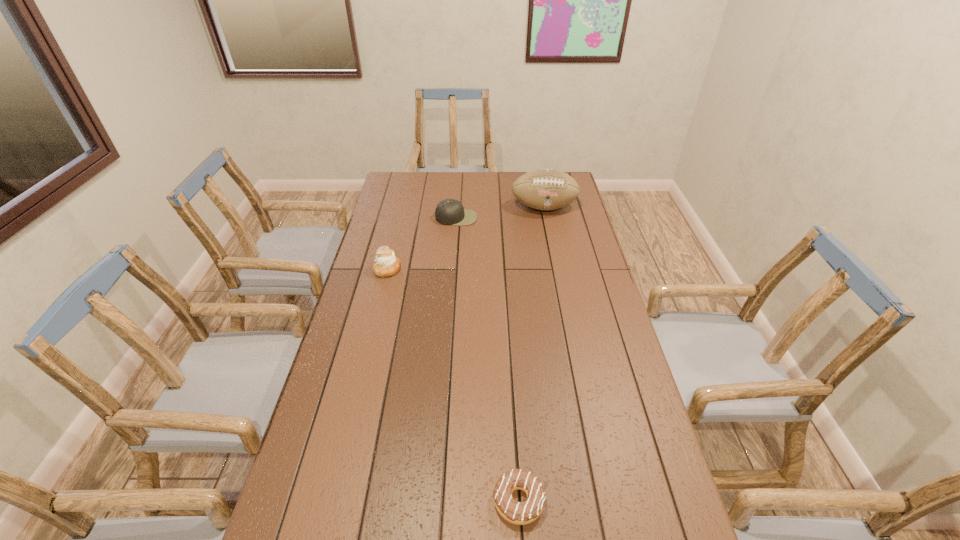
This screenshot has width=960, height=540. In order to click on object that is the second closest to the cap in this screenshot , I will do `click(386, 264)`.

Locate an element on the screen. This screenshot has width=960, height=540. object that stands as the closest to the shortest object is located at coordinates (386, 264).